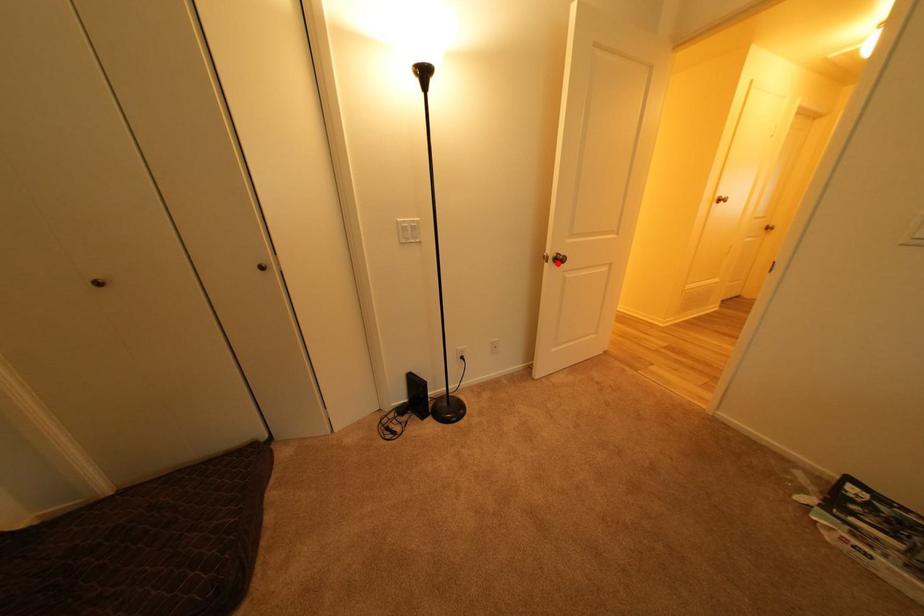
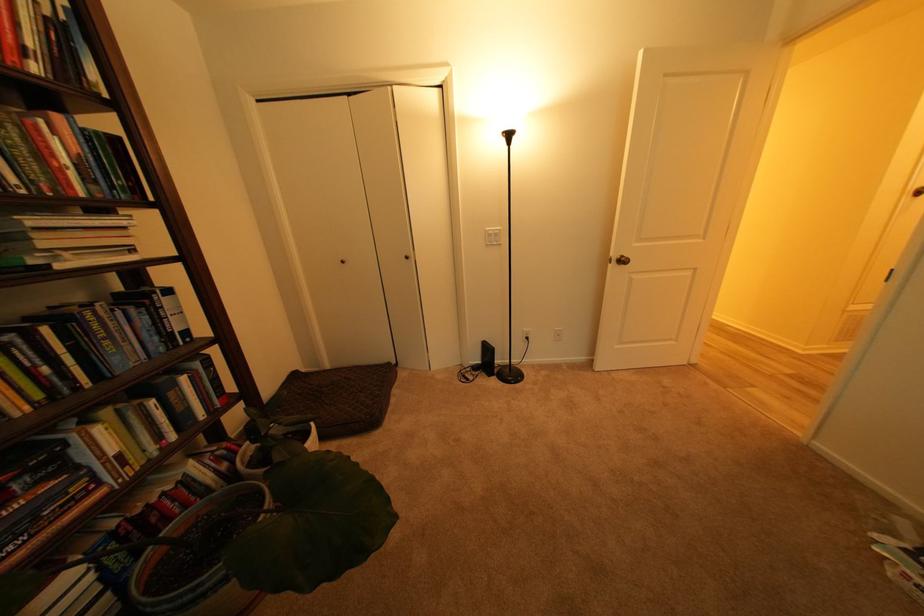
The point at the highlighted location is marked in the first image. Where is the corresponding point in the second image?

(621, 265)